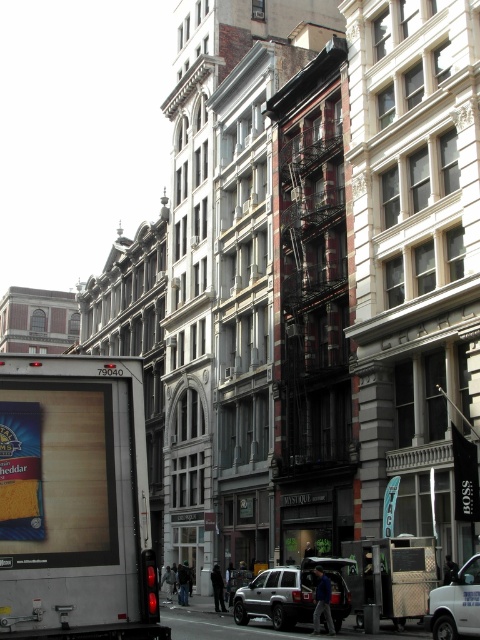
You are standing on the street looking at the buildings. There are two points marked on the image. One is at point (45,516) and the other is at point (264,600). Which point is closer to you?

Point (45,516) is closer to the viewer than point (264,600).

You are a photographer standing on the street and want to take a picture of the blue cardboard cheese at center and the yellow cheese at center. Which one will appear larger in your photo?

The blue cardboard cheese at center will appear larger in the photo because it is closer to the viewer than the yellow cheese at center.